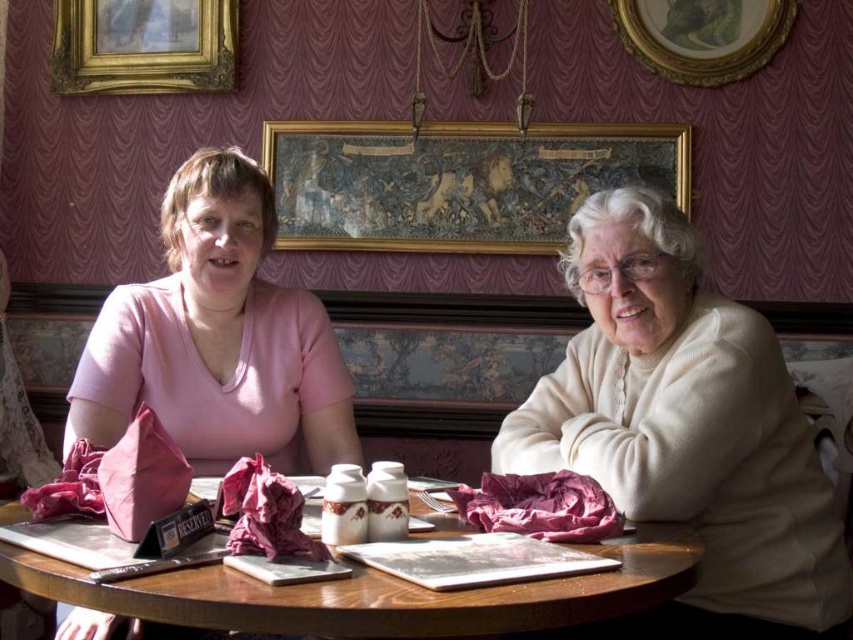
Who is more forward, (x=341, y=422) or (x=230, y=596)?

Point (x=230, y=596) is in front.

What do you see at coordinates (218, 337) in the screenshot? I see `matte pink sweater at left` at bounding box center [218, 337].

What do you see at coordinates (218, 337) in the screenshot?
I see `matte pink sweater at left` at bounding box center [218, 337].

Find the location of a particular element. The height and width of the screenshot is (640, 853). matte pink sweater at left is located at coordinates (218, 337).

Does white woolen sweater at right have a lesser width compared to matte pink sweater at left?

Incorrect, white woolen sweater at right's width is not less than matte pink sweater at left's.

At what (x,y) coordinates should I click in order to perform the action: click on white woolen sweater at right. Please return your answer as a coordinate pair (x, y). The width and height of the screenshot is (853, 640). Looking at the image, I should click on (686, 429).

Where is `white woolen sweater at right`? white woolen sweater at right is located at coordinates (686, 429).

Does white woolen sweater at right have a smaller size compared to gold-framed picture at upper center?

Actually, white woolen sweater at right might be larger than gold-framed picture at upper center.

Is white woolen sweater at right to the right of gold-framed picture at upper center from the viewer's perspective?

In fact, white woolen sweater at right is to the left of gold-framed picture at upper center.

Who is more distant from viewer, (x=608, y=368) or (x=686, y=8)?

The point (x=686, y=8) is more distant.

Identify the location of white woolen sweater at right. The height and width of the screenshot is (640, 853). (686, 429).